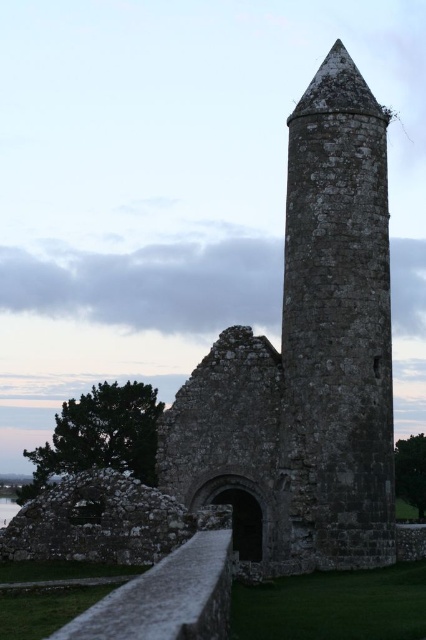
Question: Can you confirm if rustic stone tower at center is positioned to the left of rough stone tower at center?

Choices:
 (A) yes
 (B) no

Answer: (A)

Question: Among these objects, which one is farthest from the camera?

Choices:
 (A) transparent water at lower left
 (B) rustic stone tower at center

Answer: (B)

Question: Is rough stone tower at center thinner than transparent water at lower left?

Choices:
 (A) yes
 (B) no

Answer: (A)

Question: Is rustic stone tower at center closer to camera compared to transparent water at lower left?

Choices:
 (A) no
 (B) yes

Answer: (A)

Question: Which point is closer to the camera?

Choices:
 (A) rough stone tower at center
 (B) transparent water at lower left
 (C) rustic stone tower at center

Answer: (B)

Question: Which is nearer to the rustic stone tower at center?

Choices:
 (A) rough stone tower at center
 (B) transparent water at lower left

Answer: (A)